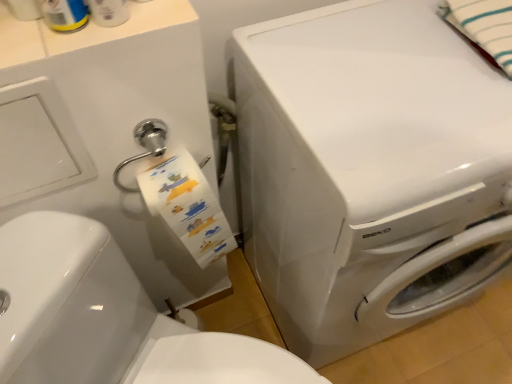
Question: From a real-world perspective, relative to white glossy washer at center, is white striped fabric at upper right vertically above or below?

Choices:
 (A) below
 (B) above

Answer: (B)

Question: Is white striped fabric at upper right taller or shorter than white glossy washer at center?

Choices:
 (A) short
 (B) tall

Answer: (A)

Question: Which is farther from the white glossy washer at center?

Choices:
 (A) white glossy washing machine at center
 (B) white striped fabric at upper right

Answer: (B)

Question: Which is nearer to the white glossy washer at center?

Choices:
 (A) white glossy washing machine at center
 (B) white striped fabric at upper right

Answer: (A)